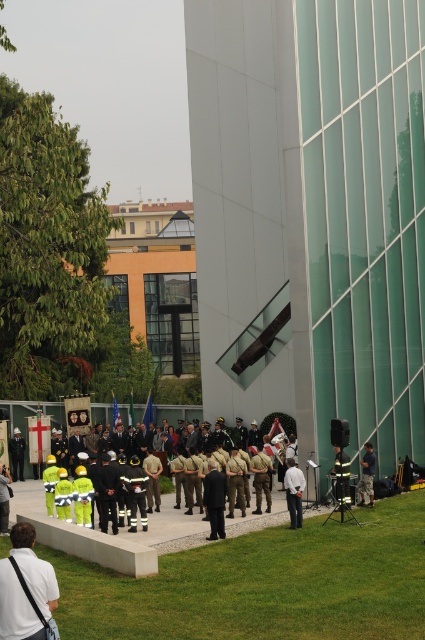
At what (x,y) coordinates should I click in order to perform the action: click on white fabric uniform at lower left. Please return your answer as a coordinate pair (x, y). The width and height of the screenshot is (425, 640). Looking at the image, I should click on (14, 605).

Can you confirm if white fabric uniform at lower left is positioned to the right of reflective silver helmet at center?

No, white fabric uniform at lower left is not to the right of reflective silver helmet at center.

Between point (17, 637) and point (337, 456), which one is positioned in front?

Point (17, 637) is more forward.

Find the location of `white fabric uniform at lower left`. white fabric uniform at lower left is located at coordinates (14, 605).